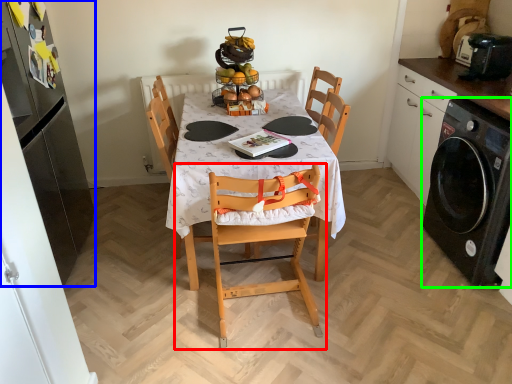
Question: Which object is the farthest from chair (highlighted by a red box)? Choose among these: cabinetry (highlighted by a blue box) or kitchen appliance (highlighted by a green box).

Choices:
 (A) cabinetry
 (B) kitchen appliance

Answer: (A)